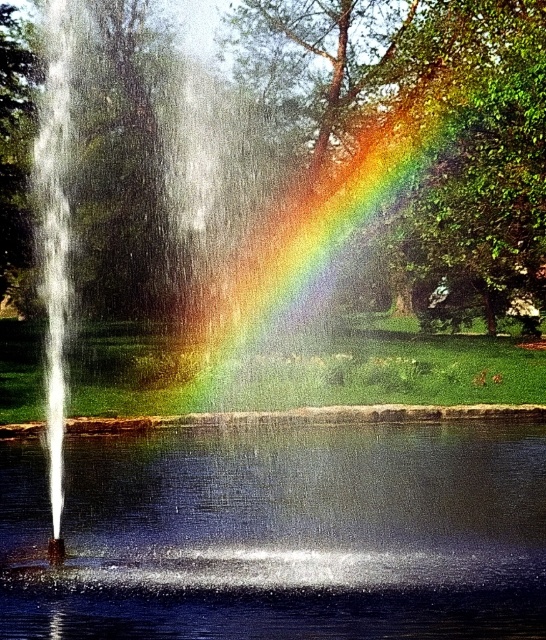
Is transparent glass lake at center behind rainbow at center?

No, it is not.

Does transparent glass lake at center come in front of rainbow at center?

Yes, transparent glass lake at center is in front of rainbow at center.

Where is `transparent glass lake at center`? transparent glass lake at center is located at coordinates (281, 532).

The height and width of the screenshot is (640, 546). In order to click on transparent glass lake at center in this screenshot , I will do `click(281, 532)`.